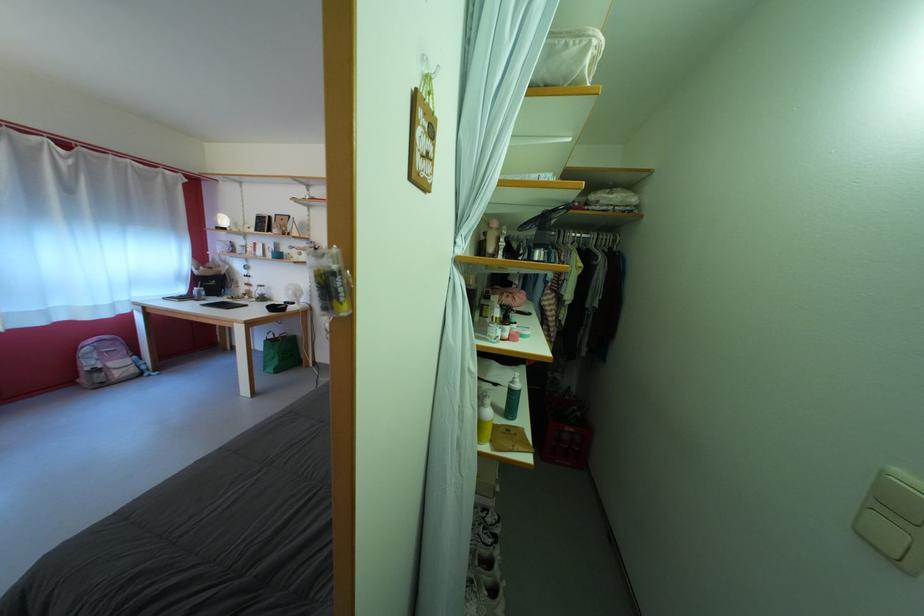
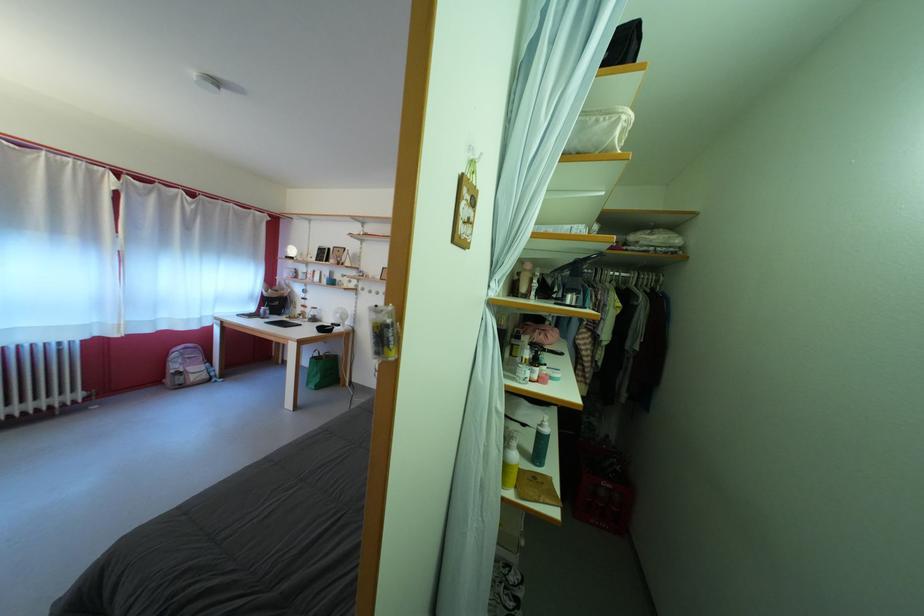
Find the pixel in the second image that matches [99,370] in the first image.

(184, 373)